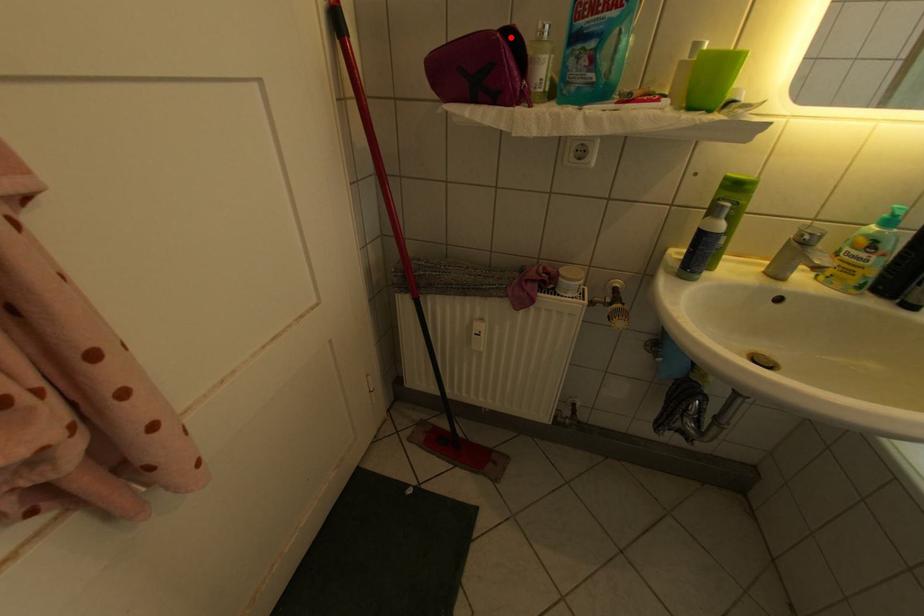
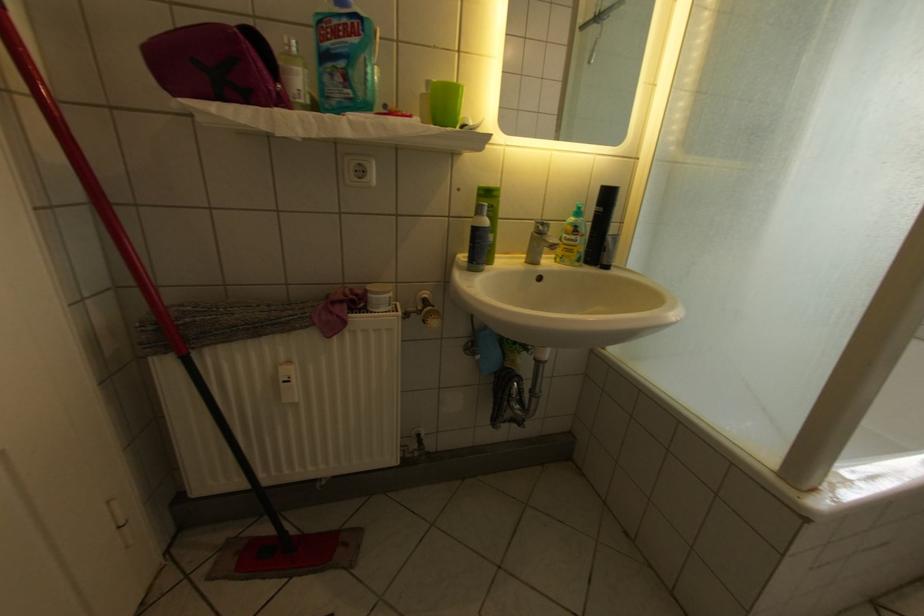
In the second image, find the point that corresponds to the highlighted location in the first image.

(247, 30)